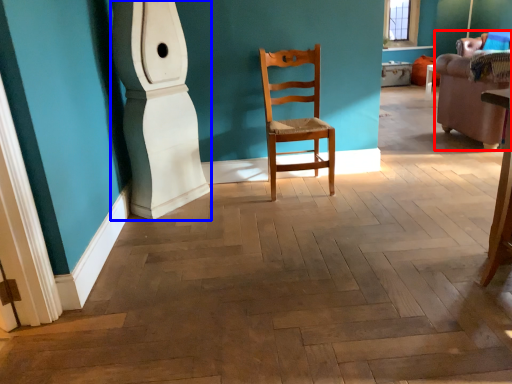
Question: Which of the following is the closest to the observer, armchair (highlighted by a red box) or pillar (highlighted by a blue box)?

Choices:
 (A) armchair
 (B) pillar

Answer: (B)